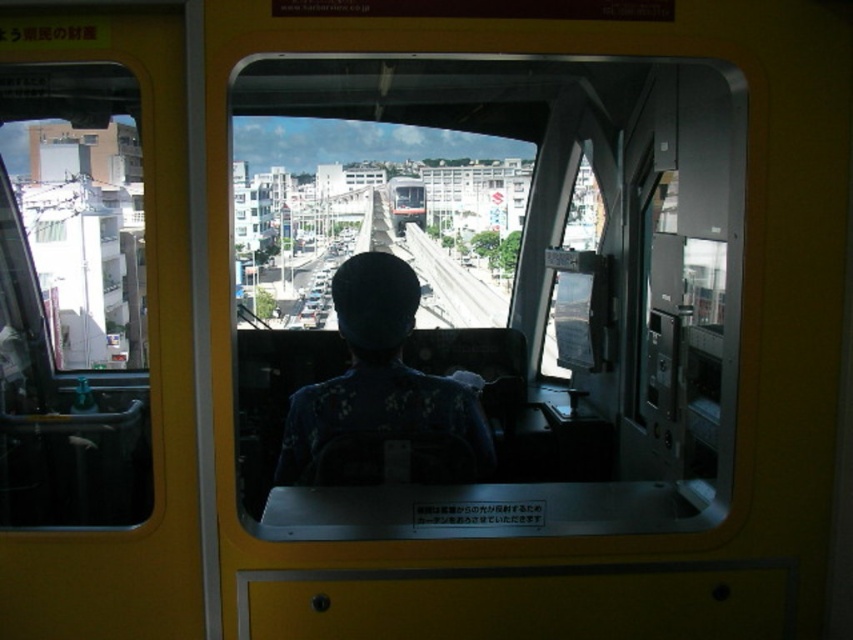
Does transparent glass train window at upper left have a lesser width compared to dark blue uniform at center?

Yes, transparent glass train window at upper left is thinner than dark blue uniform at center.

Does transparent glass train window at upper left have a larger size compared to dark blue uniform at center?

Result: Yes, transparent glass train window at upper left is bigger than dark blue uniform at center.

Locate an element on the screen. transparent glass train window at upper left is located at coordinates (73, 298).

Which is more to the left, transparent glass train window at center or dark blue uniform at center?

dark blue uniform at center is more to the left.

Is point (440, 122) more distant than point (485, 420)?

No, (440, 122) is in front of (485, 420).

This screenshot has height=640, width=853. Describe the element at coordinates (491, 296) in the screenshot. I see `transparent glass train window at center` at that location.

You are a GUI agent. You are given a task and a screenshot of the screen. Output one action in this format:
    pyautogui.click(x=<x>, y=<y>)
    Task: Click on the transparent glass train window at center
    
    Given the screenshot: What is the action you would take?
    pyautogui.click(x=491, y=296)

Is transparent glass train window at center smaller than transparent glass train window at upper left?

No.

Which is more to the right, transparent glass train window at center or transparent glass train window at upper left?

From the viewer's perspective, transparent glass train window at center appears more on the right side.

Which is in front, point (561, 234) or point (94, 445)?

Point (561, 234) is more forward.

This screenshot has height=640, width=853. What are the coordinates of `transparent glass train window at center` in the screenshot? It's located at pos(491,296).